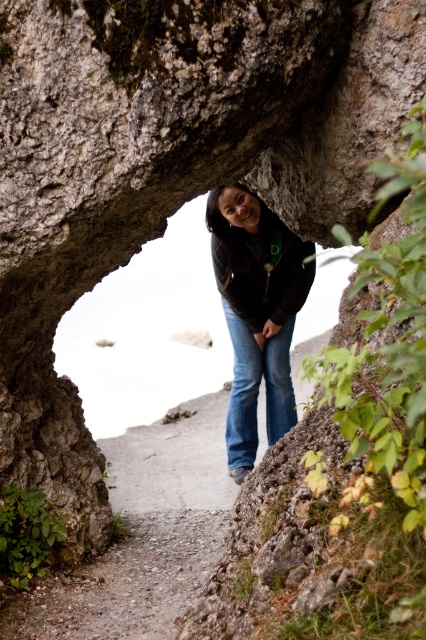
Question: Among these objects, which one is nearest to the camera?

Choices:
 (A) smooth concrete path at center
 (B) matte black jacket at center

Answer: (A)

Question: Is smooth concrete path at center closer to camera compared to matte black jacket at center?

Choices:
 (A) no
 (B) yes

Answer: (B)

Question: Which object is closer to the camera taking this photo?

Choices:
 (A) smooth concrete path at center
 (B) matte black jacket at center

Answer: (A)

Question: Can you confirm if smooth concrete path at center is positioned above matte black jacket at center?

Choices:
 (A) no
 (B) yes

Answer: (A)

Question: Does smooth concrete path at center lie in front of matte black jacket at center?

Choices:
 (A) no
 (B) yes

Answer: (B)